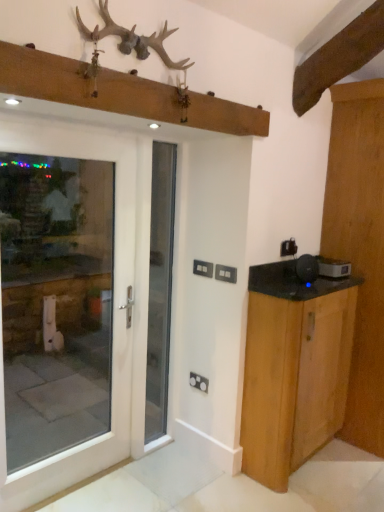
Find the location of a particular element. The width and height of the screenshot is (384, 512). free space to the back side of black plastic speaker at right, the second appliance when ordered from back to front is located at coordinates (295, 281).